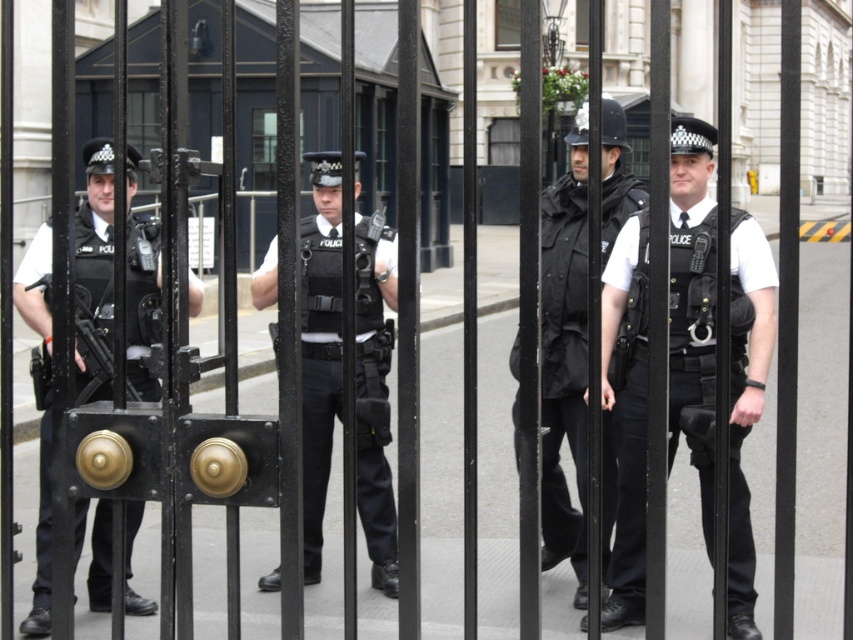
Who is positioned more to the left, black matte uniform at center or white matte uniform at center?

Positioned to the left is black matte uniform at center.

Between point (363, 438) and point (635, 512), which one is positioned in front?

Point (635, 512) is in front.

Measure the distance between black matte uniform at center and camera.

5.90 meters

What are the coordinates of `black matte uniform at center` in the screenshot? It's located at pyautogui.click(x=318, y=374).

In the scene shown: Is matte black uniform at left to the left of black matte uniform at center from the viewer's perspective?

Indeed, matte black uniform at left is positioned on the left side of black matte uniform at center.

Who is more forward, (79, 269) or (355, 352)?

Point (355, 352) is more forward.

Where is `matte black uniform at left`? The height and width of the screenshot is (640, 853). matte black uniform at left is located at coordinates tap(96, 232).

Does black matte vest at center appear on the left side of white matte uniform at center?

Correct, you'll find black matte vest at center to the left of white matte uniform at center.

Who is more distant from viewer, [558,292] or [688,227]?

Positioned behind is point [558,292].

This screenshot has width=853, height=640. What do you see at coordinates (563, 369) in the screenshot?
I see `black matte vest at center` at bounding box center [563, 369].

The width and height of the screenshot is (853, 640). Identify the location of black matte vest at center. (563, 369).